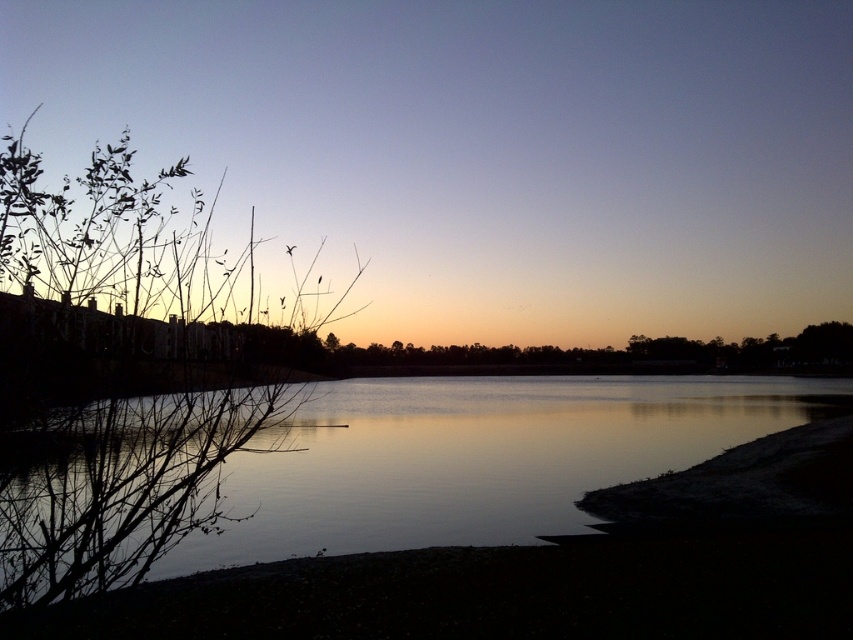
Based on the photo, does green leafy branches at left have a lesser width compared to silvery reflective water at center?

Correct, green leafy branches at left's width is less than silvery reflective water at center's.

Which of these two, green leafy branches at left or silvery reflective water at center, stands taller?

green leafy branches at left is taller.

Who is more distant from viewer, [4,451] or [514,497]?

The point [514,497] is more distant.

The image size is (853, 640). What are the coordinates of `green leafy branches at left` in the screenshot? It's located at (125, 378).